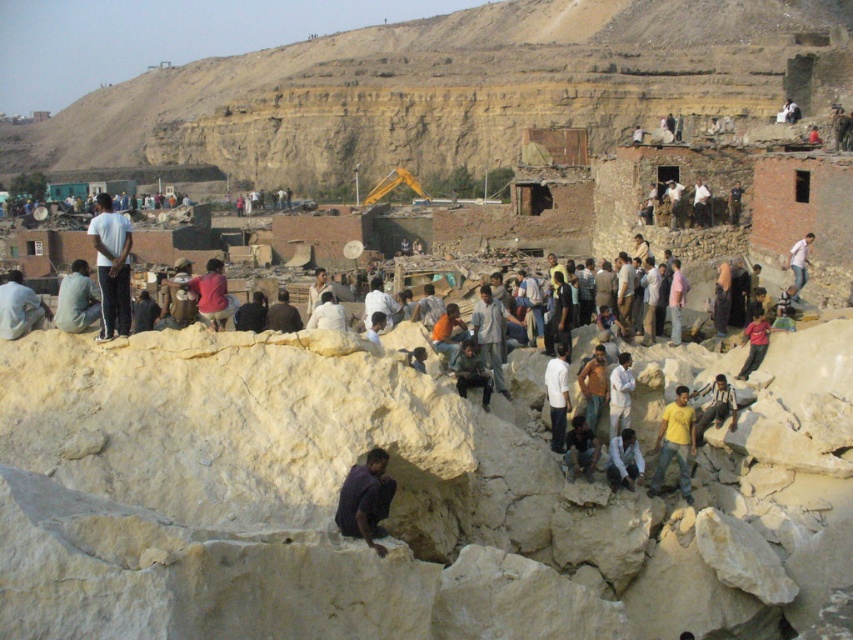
Question: Can you confirm if dark purple shirt at lower center is thinner than dark blue shirt at center?

Choices:
 (A) yes
 (B) no

Answer: (B)

Question: Which object appears closest to the camera in this image?

Choices:
 (A) white cotton shirt at center
 (B) dark blue shirt at center

Answer: (A)

Question: Which object is positioned closest to the yellow matte shirt at lower right?

Choices:
 (A) light brown fabric shirt at upper left
 (B) dark blue shirt at center
 (C) light brown leather jacket at lower right
 (D) white cotton shirt at center

Answer: (D)

Question: Estimate the real-world distances between objects in this image. Which object is farther from the dark blue shirt at center?

Choices:
 (A) dark purple shirt at lower center
 (B) light gray fabric shirt at center

Answer: (A)

Question: Does light blue shirt at left appear over light blue striped shirt at center?

Choices:
 (A) yes
 (B) no

Answer: (A)

Question: Is light blue shirt at left closer to camera compared to light brown leather jacket at lower right?

Choices:
 (A) no
 (B) yes

Answer: (B)